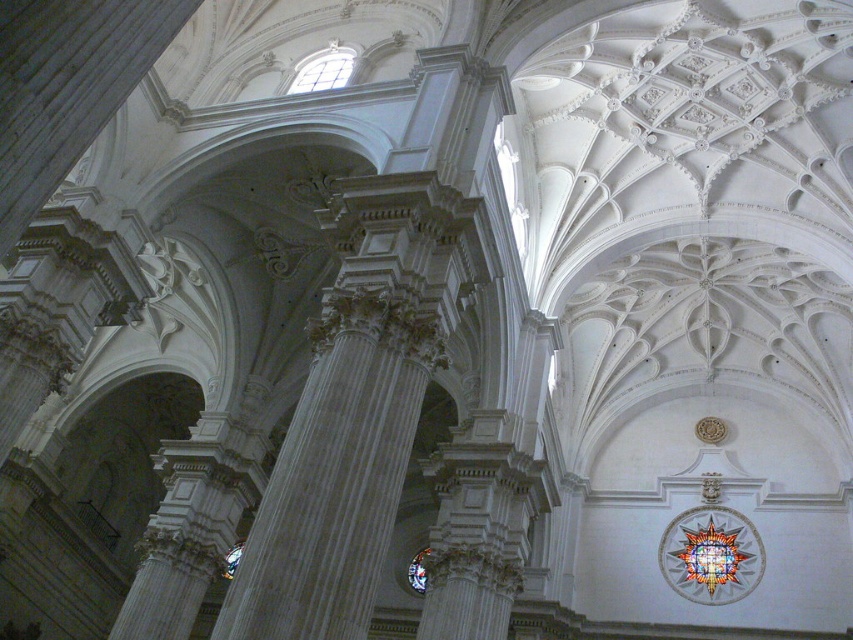
I want to click on clear glass window at upper center, so click(x=323, y=70).

This screenshot has height=640, width=853. I want to click on clear glass window at upper center, so [323, 70].